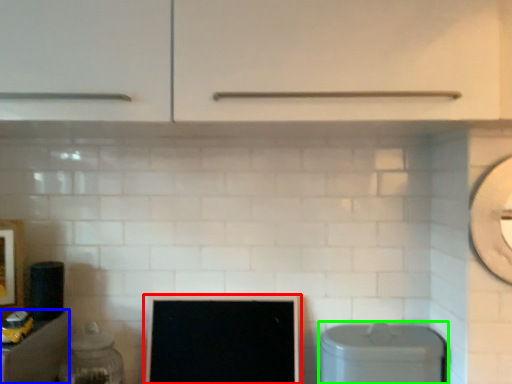
Question: Based on their relative distances, which object is nearer to computer monitor (highlighted by a red box)? Choose from cabinetry (highlighted by a blue box) and dish washer (highlighted by a green box).

Choices:
 (A) cabinetry
 (B) dish washer

Answer: (B)